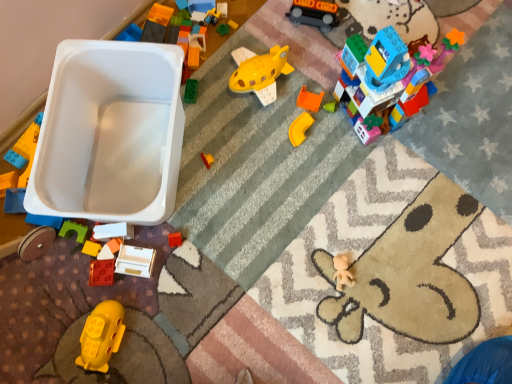
The image size is (512, 384). I want to click on vacant area that lies between white plastic toy car at upper left and shiny black train at upper center, the 7th toy when ordered from left to right, so click(x=238, y=103).